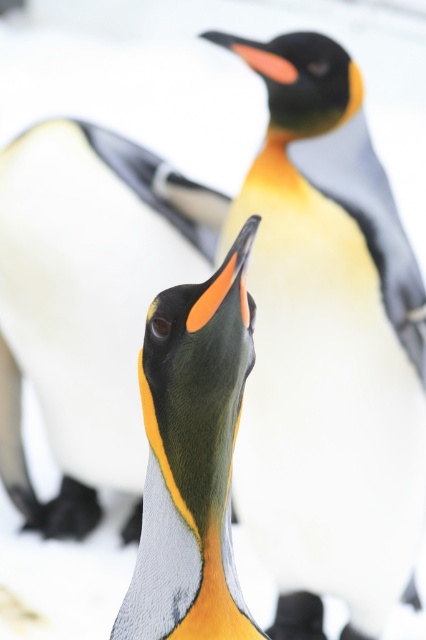
You are observing two points in the image. The first point is at coordinates point (x=115, y=416) and the second point is at point (x=164, y=442). Based on the scene, which point is closer to the camera?

Point (x=164, y=442) is closer to the camera than point (x=115, y=416).